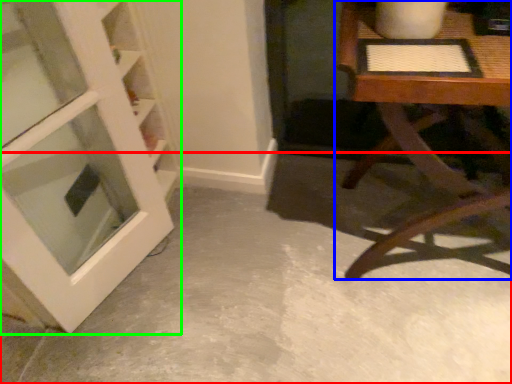
Question: Based on their relative distances, which object is farther from concrete (highlighted by a red box)? Choose from table (highlighted by a blue box) and door (highlighted by a green box).

Choices:
 (A) table
 (B) door

Answer: (B)